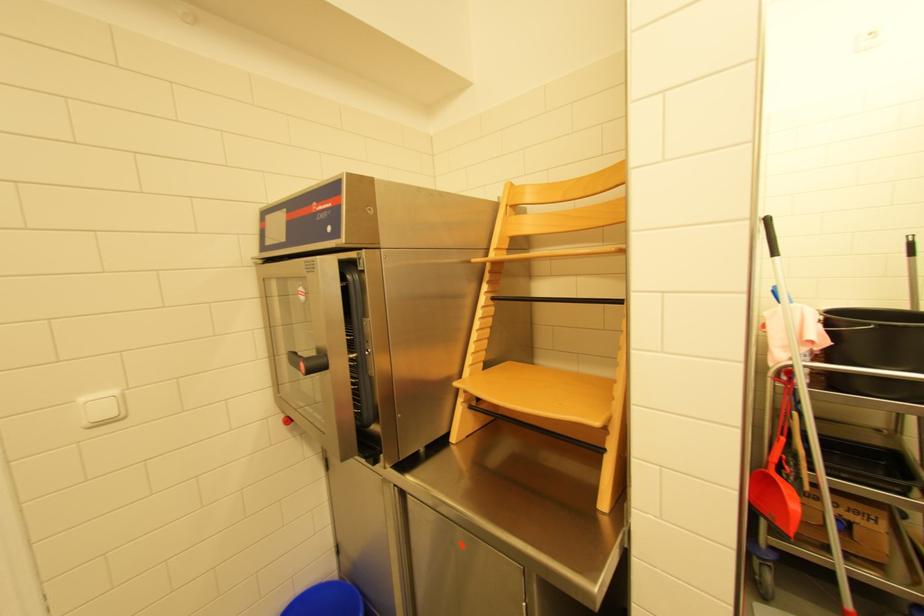
The height and width of the screenshot is (616, 924). What do you see at coordinates (102, 408) in the screenshot?
I see `the white light switch` at bounding box center [102, 408].